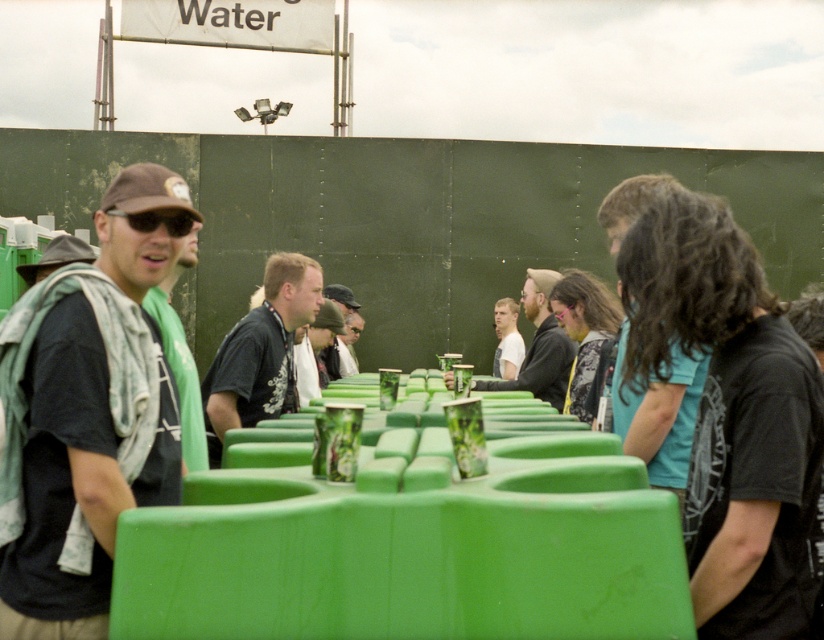
Question: Is black matte shirt at center wider than dark gray fabric jacket at center?

Choices:
 (A) yes
 (B) no

Answer: (A)

Question: Which point is closer to the camera?

Choices:
 (A) white matte shirt at center
 (B) matte black t-shirt at left
 (C) black matte shirt at center
 (D) dark gray fabric jacket at center

Answer: (B)

Question: Which of the following is the farthest from the observer?

Choices:
 (A) white matte shirt at center
 (B) matte black shirt at center
 (C) black matte shirt at center
 (D) dark gray fabric jacket at center

Answer: (A)

Question: Among these objects, which one is farthest from the camera?

Choices:
 (A) matte black t-shirt at left
 (B) dark gray fabric jacket at center
 (C) white matte shirt at center

Answer: (C)

Question: Is matte black shirt at center further to the viewer compared to white matte shirt at center?

Choices:
 (A) no
 (B) yes

Answer: (A)

Question: From the image, what is the correct spatial relationship of black matte shirt at center in relation to matte black shirt at center?

Choices:
 (A) below
 (B) above

Answer: (A)